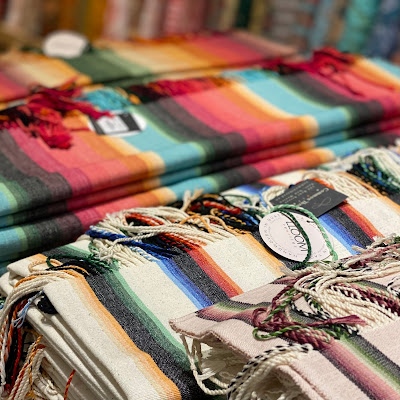
At what (x,y) coordinates should I click in order to perform the action: click on multicolor yarn hanging down in bottom left corner. Please return your answer as a coordinate pair (x, y). The width and height of the screenshot is (400, 400). Looking at the image, I should click on (1, 323), (10, 332), (14, 347), (32, 375), (21, 388).